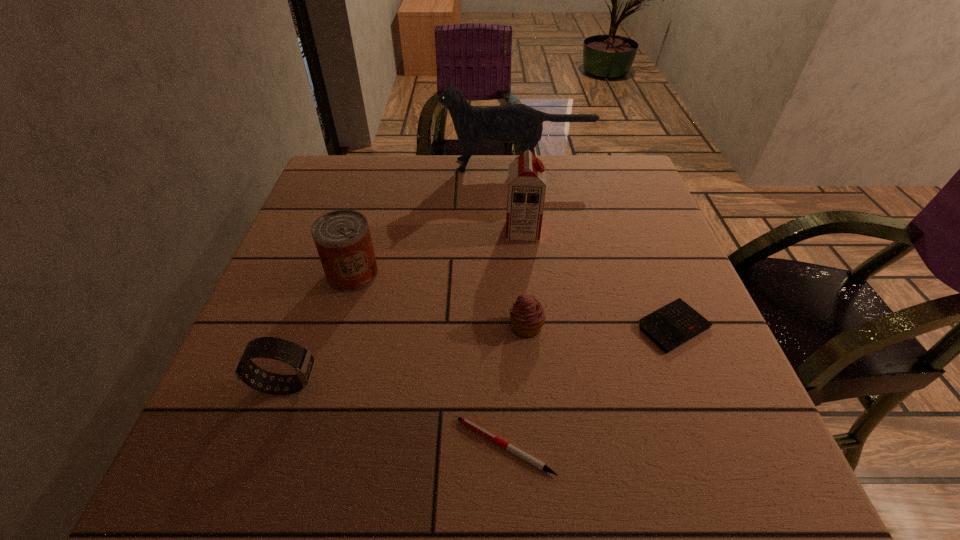
Locate an element on the screen. unoccupied position between the fifth tallest object and the pen is located at coordinates (516, 387).

The height and width of the screenshot is (540, 960). Identify the location of free space between the cat and the sixth tallest object. (595, 246).

Where is `empty space between the fifth shortest object and the fourth shortest object`? empty space between the fifth shortest object and the fourth shortest object is located at coordinates (320, 329).

Where is `free space between the fifth shortest object and the watch`? The image size is (960, 540). free space between the fifth shortest object and the watch is located at coordinates (320, 329).

I want to click on vacant space in between the nearest object and the fourth shortest object, so click(x=396, y=416).

Identify which object is located as the fifth nearest to the second farthest object. Please provide its 2D coordinates. Your answer should be formatted as a tuple, i.e. [(x, y)], where the tuple contains the x and y coordinates of a point satisfying the conditions above.

[(464, 421)]

Identify which object is the third nearest to the second nearest object. Please provide its 2D coordinates. Your answer should be formatted as a tuple, i.e. [(x, y)], where the tuple contains the x and y coordinates of a point satisfying the conditions above.

[(527, 316)]

Identify the location of free location that satisfies the following two spatial constraints: 1. on the front side of the can; 2. on the left side of the cupcake. The height and width of the screenshot is (540, 960). (337, 328).

Where is `free location that satisfies the following two spatial constraints: 1. on the front side of the soya milk; 2. on the face of the sixth farthest object`? The image size is (960, 540). free location that satisfies the following two spatial constraints: 1. on the front side of the soya milk; 2. on the face of the sixth farthest object is located at coordinates (539, 385).

The width and height of the screenshot is (960, 540). Identify the location of vacant space that satisfies the following two spatial constraints: 1. on the front side of the third farthest object; 2. on the face of the watch. (321, 385).